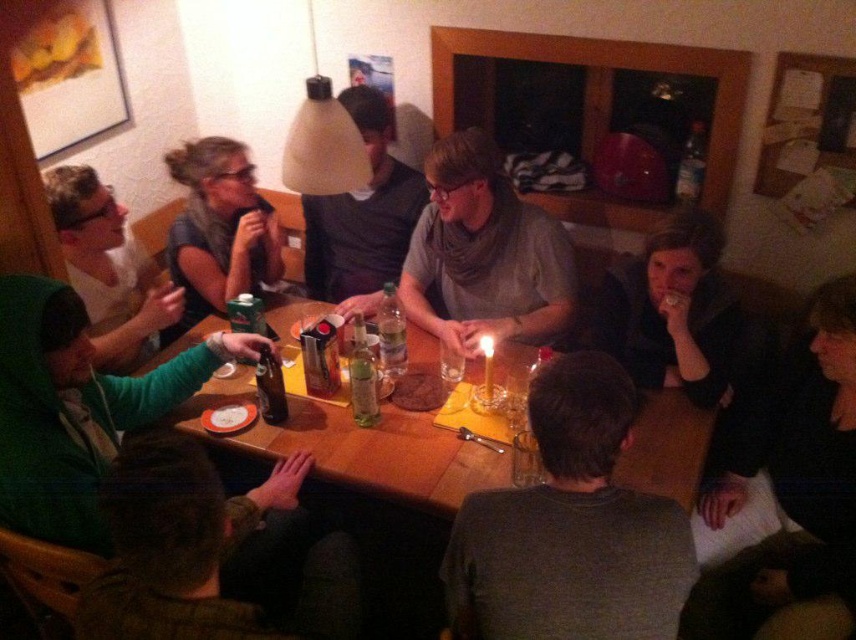
You are standing at the center of the table and want to place a small item on the black fabric at lower right. To do so, in which direction should you move your hand relative to the table?

The black fabric at lower right is located at coordinates point (x=786, y=497), so you should move your hand towards the lower right direction relative to the table.

You are a photographer trying to capture a group photo of the dark gray sweater at center and the green matte shirt at left. Since you want to ensure both are clearly visible, which one should you focus on first to account for their sizes?

The dark gray sweater at center is smaller than the green matte shirt at left, so you should focus on the dark gray sweater at center first to ensure it is clearly visible.